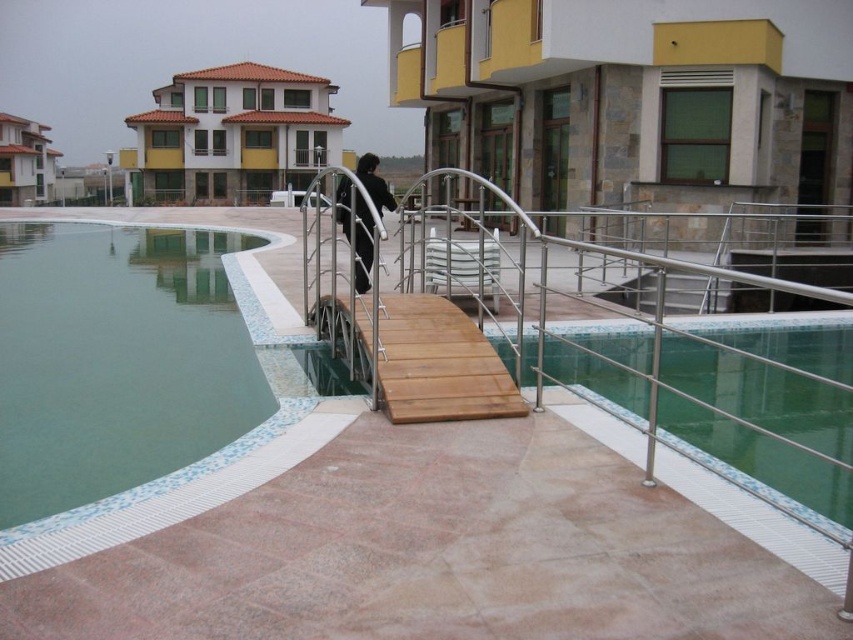
Question: Which object is positioned closest to the black matte clothing at center?

Choices:
 (A) metallic silver stair at center
 (B) smooth tile swimming pool at center

Answer: (B)

Question: Does smooth tile swimming pool at center come in front of metallic silver stair at center?

Choices:
 (A) no
 (B) yes

Answer: (B)

Question: Is smooth tile swimming pool at center thinner than black matte clothing at center?

Choices:
 (A) yes
 (B) no

Answer: (B)

Question: Observing the image, what is the correct spatial positioning of metallic silver stair at center in reference to black matte clothing at center?

Choices:
 (A) right
 (B) left

Answer: (A)

Question: Which object is the closest to the smooth tile swimming pool at center?

Choices:
 (A) black matte clothing at center
 (B) metallic silver stair at center

Answer: (B)

Question: Which object is farther from the camera taking this photo?

Choices:
 (A) black matte clothing at center
 (B) smooth tile swimming pool at center

Answer: (A)